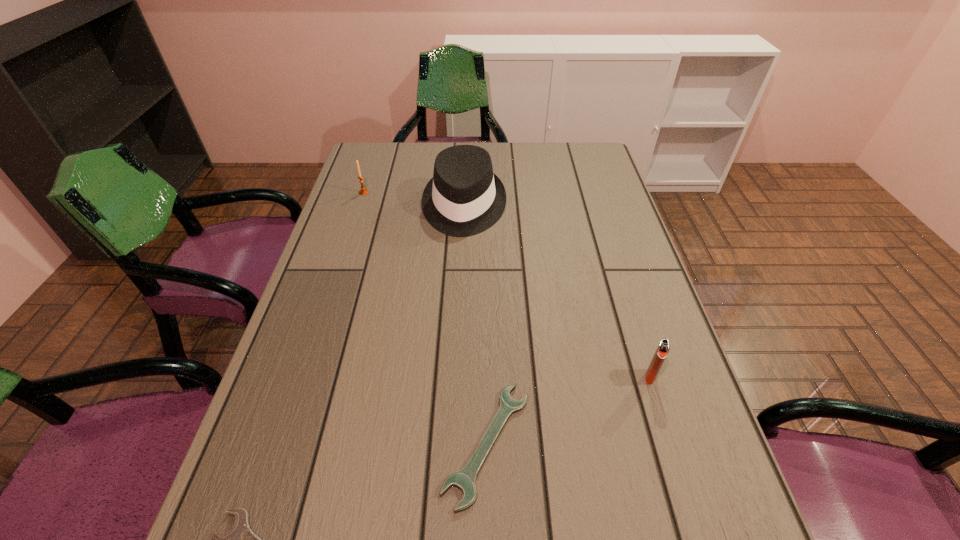
Find the location of a particular element. unoccupied area between the third nearest object and the tallest object is located at coordinates (557, 292).

I want to click on empty location between the tallest object and the right wrench, so click(x=475, y=325).

Find the location of a particular element. The width and height of the screenshot is (960, 540). free space between the candle_holder and the third nearest object is located at coordinates (507, 285).

At what (x,y) coordinates should I click in order to perform the action: click on unoccupied area between the candle_holder and the igniter. Please return your answer as a coordinate pair (x, y). Looking at the image, I should click on (507, 285).

Find the location of `free spot between the rightmost object and the right wrench`. free spot between the rightmost object and the right wrench is located at coordinates (568, 410).

Point out which object is positioned as the nearest to the rightmost object. Please provide its 2D coordinates. Your answer should be formatted as a tuple, i.e. [(x, y)], where the tuple contains the x and y coordinates of a point satisfying the conditions above.

[(465, 479)]

Point out which object is positioned as the second nearest to the fedora. Please provide its 2D coordinates. Your answer should be formatted as a tuple, i.e. [(x, y)], where the tuple contains the x and y coordinates of a point satisfying the conditions above.

[(465, 479)]

Find the location of `free space that satisfies the following two spatial constraints: 1. on the back side of the second shortest object; 2. on the right side of the rightmost object`. free space that satisfies the following two spatial constraints: 1. on the back side of the second shortest object; 2. on the right side of the rightmost object is located at coordinates (487, 376).

I want to click on free spot that satisfies the following two spatial constraints: 1. on the front side of the right wrench; 2. on the left side of the fedora, so click(454, 444).